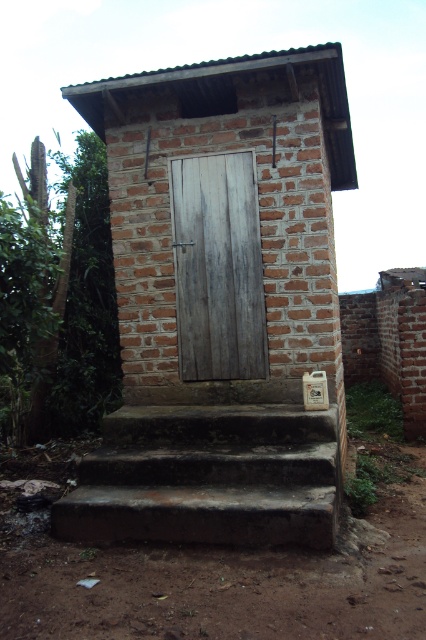
You are a maintenance worker checking the outdoor facilities. You notice the dark brown concrete stairs at center and the weathered wood door at center. Which one has a greater height?

The weathered wood door at center is taller than dark brown concrete stairs at center.

From the picture: You need to carry a large wooden crate that is 1.2 meters wide. You are standing in front of the dark brown concrete stairs at center and the weathered wood door at center. Can you fit the crate through the door without tilting it?

The dark brown concrete stairs at center is wider than the weathered wood door at center. Since the crate is 1.2 meters wide, it may not fit through the door if the door is narrower than the crate. However, the exact width of the door isn